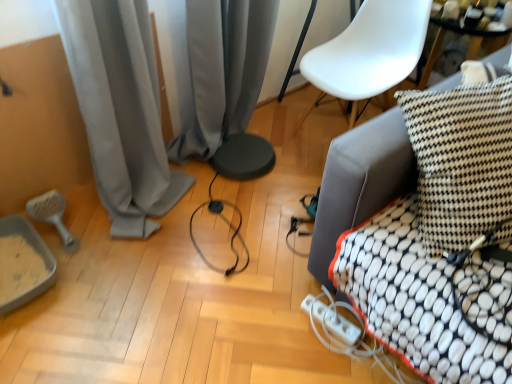
Where is `white plastic armchair at upper right`? This screenshot has height=384, width=512. white plastic armchair at upper right is located at coordinates (369, 52).

Where is `gray fabric curtain at center, the 1th curtain viewed from the right`? gray fabric curtain at center, the 1th curtain viewed from the right is located at coordinates (223, 70).

Image resolution: width=512 pixels, height=384 pixels. Identify the location of gray fabric curtain at lower left, which is the 2th curtain in right-to-left order. (121, 110).

What do you see at coordinates (121, 110) in the screenshot? The width and height of the screenshot is (512, 384). I see `gray fabric curtain at lower left, which is the 2th curtain in right-to-left order` at bounding box center [121, 110].

What is the approximate height of black and white checkered pillow at right?

black and white checkered pillow at right is 22.02 inches in height.

The height and width of the screenshot is (384, 512). What do you see at coordinates (331, 321) in the screenshot?
I see `white plastic extension cord at lower center` at bounding box center [331, 321].

Find the location of a particular element. Image resolution: width=512 pixels, height=384 pixels. white plastic armchair at upper right is located at coordinates (369, 52).

Is gray matte brush at lower left far away from gray fabric curtain at lower left, which is the 2th curtain in right-to-left order?

No, gray matte brush at lower left is in close proximity to gray fabric curtain at lower left, which is the 2th curtain in right-to-left order.

Between gray matte brush at lower left and gray fabric curtain at lower left, which is the 2th curtain in right-to-left order, which one appears on the left side from the viewer's perspective?

Positioned to the left is gray matte brush at lower left.

Is gray matte brush at lower left positioned beyond the bounds of gray fabric curtain at lower left, which is the 2th curtain in right-to-left order?

No, gray matte brush at lower left is not outside of gray fabric curtain at lower left, which is the 2th curtain in right-to-left order.

Consider the image. Does gray matte brush at lower left come in front of gray fabric curtain at lower left, marked as the 1th curtain in a left-to-right arrangement?

That is False.

From a real-world perspective, is gray fabric curtain at lower left, marked as the 1th curtain in a left-to-right arrangement, on top of gray matte brush at lower left?

Yes, from a real-world perspective, gray fabric curtain at lower left, marked as the 1th curtain in a left-to-right arrangement, is above gray matte brush at lower left.

Does point (115, 158) come in front of point (66, 242)?

Yes, it is.

How many degrees apart are the facing directions of gray fabric curtain at lower left, which is the 2th curtain in right-to-left order, and gray matte brush at lower left?

The angular difference between gray fabric curtain at lower left, which is the 2th curtain in right-to-left order, and gray matte brush at lower left is 0.645 degrees.

How much distance is there between gray fabric curtain at lower left, marked as the 1th curtain in a left-to-right arrangement, and gray matte brush at lower left?

gray fabric curtain at lower left, marked as the 1th curtain in a left-to-right arrangement, and gray matte brush at lower left are 47.76 centimeters apart.

Is point (318, 320) farther from camera compared to point (221, 5)?

No, (318, 320) is closer to viewer.

From the image's perspective, which one is positioned lower, white plastic extension cord at lower center or gray fabric curtain at center, the 2th curtain from the left?

white plastic extension cord at lower center, from the image's perspective.

Which of these two, white plastic extension cord at lower center or gray fabric curtain at center, the 2th curtain from the left, is bigger?

gray fabric curtain at center, the 2th curtain from the left, is bigger.

Is white plastic armchair at upper right with white plastic extension cord at lower center?

No, white plastic armchair at upper right is not touching white plastic extension cord at lower center.

From the image's perspective, is white plastic armchair at upper right located above or below white plastic extension cord at lower center?

white plastic armchair at upper right is situated higher than white plastic extension cord at lower center in the image.

This screenshot has width=512, height=384. Identify the location of armchair behind the white plastic extension cord at lower center. (369, 52).

How many degrees apart are the facing directions of black and white checkered pillow at right and gray matte brush at lower left?

The angular difference between black and white checkered pillow at right and gray matte brush at lower left is 29.2 degrees.

Which is behind, point (452, 211) or point (59, 225)?

Point (59, 225)

In terms of height, does black and white checkered pillow at right look taller or shorter compared to gray matte brush at lower left?

Clearly, black and white checkered pillow at right is taller compared to gray matte brush at lower left.

Between black and white checkered pillow at right and gray matte brush at lower left, which one is positioned behind?

gray matte brush at lower left is more distant.

Is point (30, 206) positioned before point (318, 82)?

Yes, it is.

Which object is more forward, gray matte brush at lower left or white plastic armchair at upper right?

white plastic armchair at upper right is closer to the camera.

Image resolution: width=512 pixels, height=384 pixels. In the image, there is a white plastic armchair at upper right. What are the coordinates of `brush below it (from a real-world perspective)` in the screenshot? It's located at (52, 215).

Could you tell me if gray matte brush at lower left is turned towards white plastic armchair at upper right?

No, gray matte brush at lower left is not aimed at white plastic armchair at upper right.

Looking at this image, considering the relative sizes of gray matte brush at lower left and gray fabric curtain at center, the 1th curtain viewed from the right, in the image provided, is gray matte brush at lower left thinner than gray fabric curtain at center, the 1th curtain viewed from the right,?

No, gray matte brush at lower left is not thinner than gray fabric curtain at center, the 1th curtain viewed from the right.

Is gray matte brush at lower left facing towards gray fabric curtain at center, the 2th curtain from the left?

No, gray matte brush at lower left is not aimed at gray fabric curtain at center, the 2th curtain from the left.

Measure the distance from gray matte brush at lower left to gray fabric curtain at center, the 1th curtain viewed from the right.

86.81 centimeters.

Does point (73, 249) come behind point (244, 126)?

No, (73, 249) is in front of (244, 126).

Find the location of a particular element. brush behind the gray fabric curtain at lower left, marked as the 1th curtain in a left-to-right arrangement is located at coordinates (52, 215).

Image resolution: width=512 pixels, height=384 pixels. Identify the location of the 1st curtain above the gray matte brush at lower left (from the image's perspective). (121, 110).

When comparing their distances from gray fabric curtain at lower left, marked as the 1th curtain in a left-to-right arrangement, does gray fabric curtain at center, the 2th curtain from the left, or gray matte brush at lower left seem further?

gray matte brush at lower left lies further to gray fabric curtain at lower left, marked as the 1th curtain in a left-to-right arrangement, than the other object.

Estimate the real-world distances between objects in this image. Which object is closer to gray fabric curtain at center, the 2th curtain from the left, white plastic extension cord at lower center or gray fabric curtain at lower left, which is the 2th curtain in right-to-left order?

gray fabric curtain at lower left, which is the 2th curtain in right-to-left order, is positioned closer to the anchor gray fabric curtain at center, the 2th curtain from the left.

Which object lies nearer to the anchor point gray fabric curtain at lower left, marked as the 1th curtain in a left-to-right arrangement, white plastic extension cord at lower center or black and white checkered pillow at right?

The object closer to gray fabric curtain at lower left, marked as the 1th curtain in a left-to-right arrangement, is white plastic extension cord at lower center.

Based on the photo, which object lies further to the anchor point white plastic extension cord at lower center, white fabric cushion at right or white plastic armchair at upper right?

white plastic armchair at upper right is further to white plastic extension cord at lower center.

Based on their spatial positions, is gray fabric curtain at lower left, which is the 2th curtain in right-to-left order, or white plastic armchair at upper right further from white plastic extension cord at lower center?

white plastic armchair at upper right lies further to white plastic extension cord at lower center than the other object.

From the image, which object appears to be nearer to white plastic extension cord at lower center, gray matte brush at lower left or gray fabric curtain at lower left, marked as the 1th curtain in a left-to-right arrangement?

gray fabric curtain at lower left, marked as the 1th curtain in a left-to-right arrangement, is closer to white plastic extension cord at lower center.

Considering their positions, is gray fabric curtain at lower left, which is the 2th curtain in right-to-left order, positioned further to gray fabric curtain at center, the 1th curtain viewed from the right, than white plastic armchair at upper right?

The object further to gray fabric curtain at center, the 1th curtain viewed from the right, is white plastic armchair at upper right.

Estimate the real-world distances between objects in this image. Which object is closer to gray matte brush at lower left, gray fabric curtain at center, the 1th curtain viewed from the right, or white plastic extension cord at lower center?

gray fabric curtain at center, the 1th curtain viewed from the right.

What are the coordinates of `furniture between gray fabric curtain at center, the 2th curtain from the left, and white plastic extension cord at lower center from top to bottom` in the screenshot? It's located at (360, 181).

This screenshot has width=512, height=384. I want to click on extension cord between gray matte brush at lower left and black and white checkered pillow at right, so click(331, 321).

The image size is (512, 384). I want to click on extension cord between gray fabric curtain at lower left, which is the 2th curtain in right-to-left order, and white fabric cushion at right from left to right, so click(331, 321).

You are a GUI agent. You are given a task and a screenshot of the screen. Output one action in this format:
    pyautogui.click(x=<x>, y=<y>)
    Task: Click on the armchair situated between gray fabric curtain at lower left, which is the 2th curtain in right-to-left order, and white fabric cushion at right from left to right
    
    Given the screenshot: What is the action you would take?
    pyautogui.click(x=369, y=52)